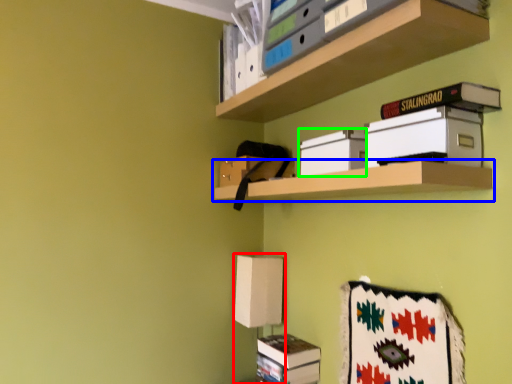
Question: Estimate the real-world distances between objects in this image. Which object is farther from table lamp (highlighted by a red box), shelf (highlighted by a blue box) or box (highlighted by a green box)?

Choices:
 (A) shelf
 (B) box

Answer: (B)